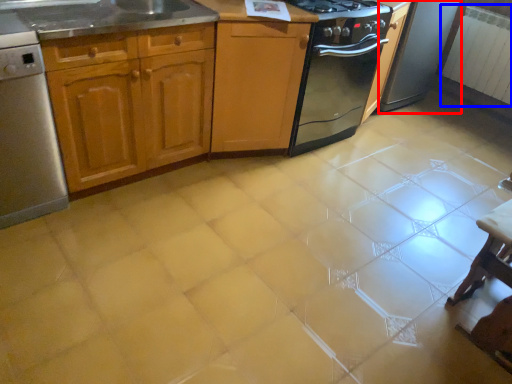
Question: Which object appears farthest to the camera in this image, appliance (highlighted by a red box) or radiator (highlighted by a blue box)?

Choices:
 (A) appliance
 (B) radiator

Answer: (B)